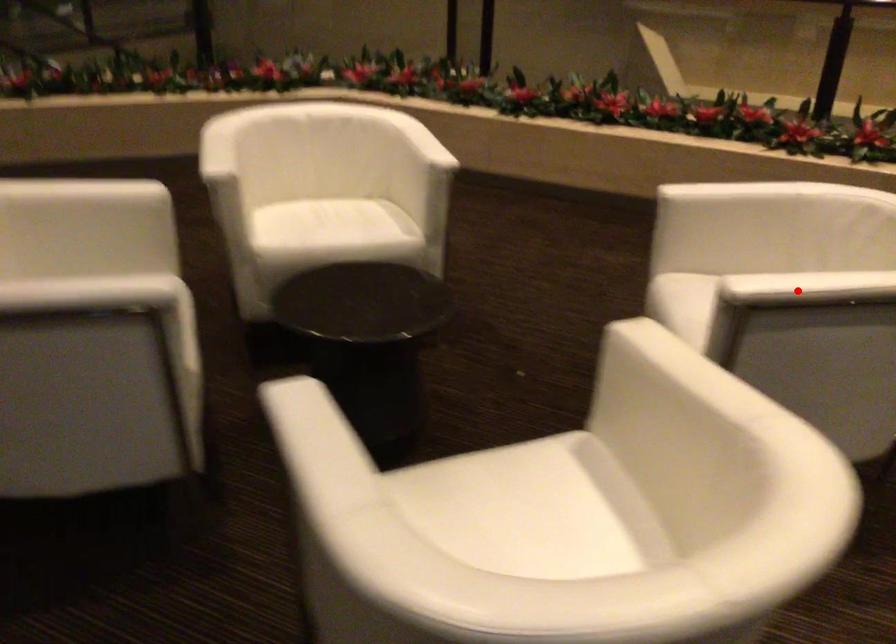
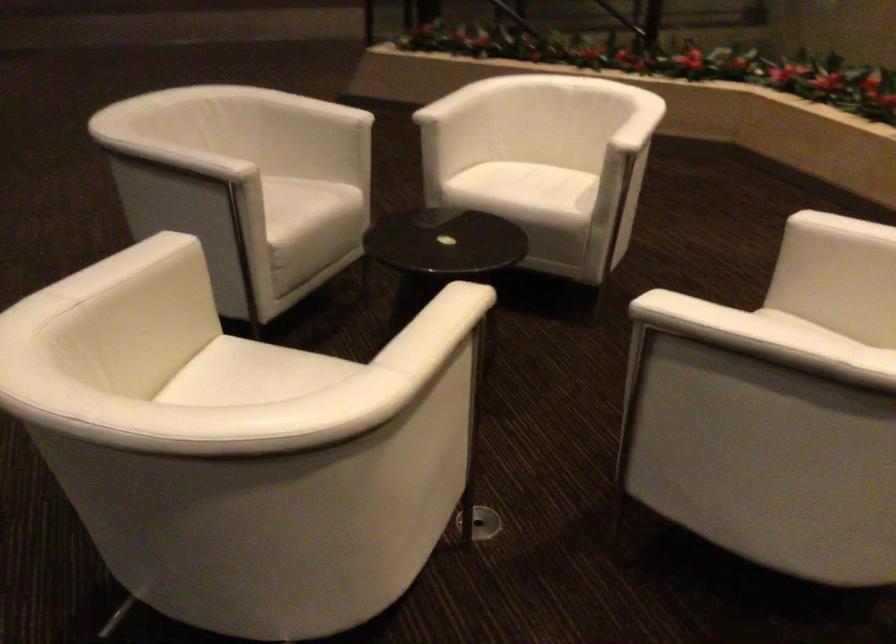
Question: I am providing you with two images of the same scene from different viewpoints. Given a red point in image1, look at the same physical point in image2. Is it:

Choices:
 (A) Closer to the viewpoint
 (B) Farther from the viewpoint

Answer: (A)